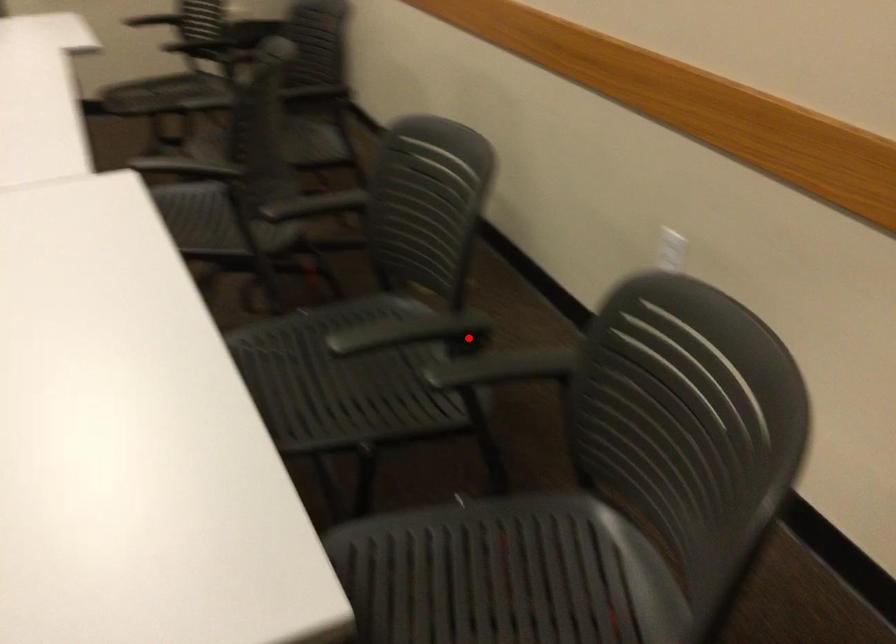
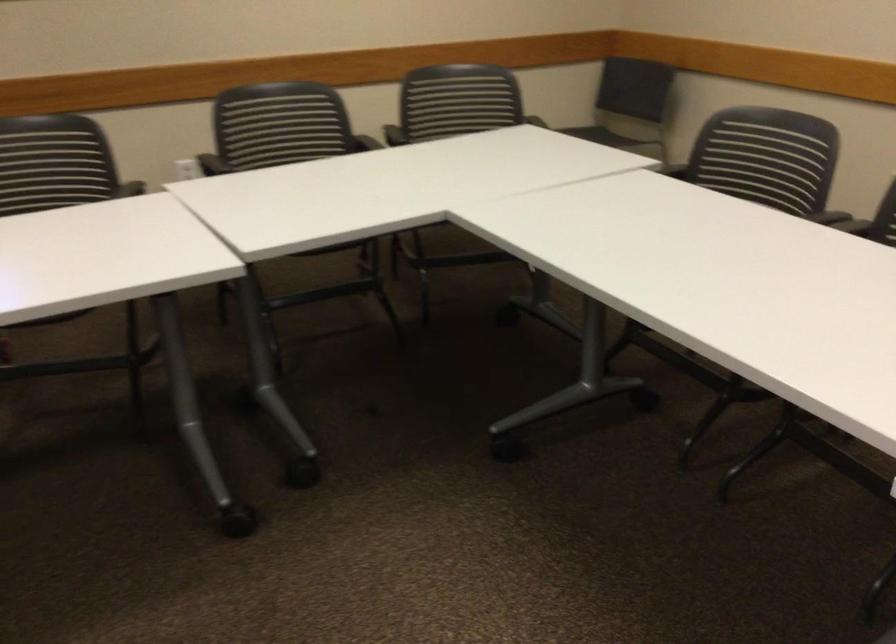
Question: A red point is marked in image1. In image2, is the corresponding 3D point closer to the camera or farther? Reply with the corresponding letter.

Choices:
 (A) The corresponding 3D point is closer.
 (B) The corresponding 3D point is farther.

Answer: (B)